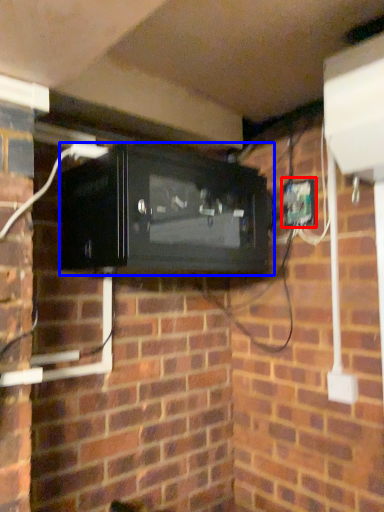
Question: Which point is further to the camera, electric outlet (highlighted by a red box) or appliance (highlighted by a blue box)?

Choices:
 (A) electric outlet
 (B) appliance

Answer: (A)